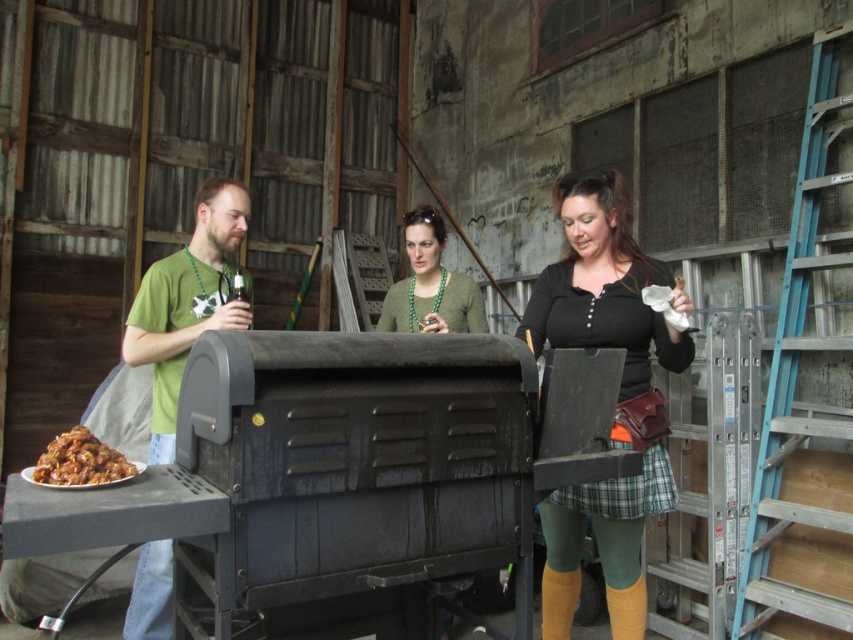
Question: Which of the following is the closest to the observer?

Choices:
 (A) matte green sweater at center
 (B) blue metallic ladder at right
 (C) brown glossy meat at lower left
 (D) green beaded necklace at center

Answer: (C)

Question: Which point is closer to the camera?

Choices:
 (A) green matte shirt at left
 (B) matte green sweater at center

Answer: (A)

Question: Can you confirm if matte black laptop at center is thinner than matte green sweater at center?

Choices:
 (A) yes
 (B) no

Answer: (B)

Question: Is matte black laptop at center closer to the viewer compared to matte green sweater at center?

Choices:
 (A) no
 (B) yes

Answer: (B)

Question: Is green matte shirt at left below brown glossy meat at lower left?

Choices:
 (A) no
 (B) yes

Answer: (A)

Question: Which of the following is the farthest from the observer?

Choices:
 (A) (757, 618)
 (B) (67, 461)
 (C) (604, 486)

Answer: (A)